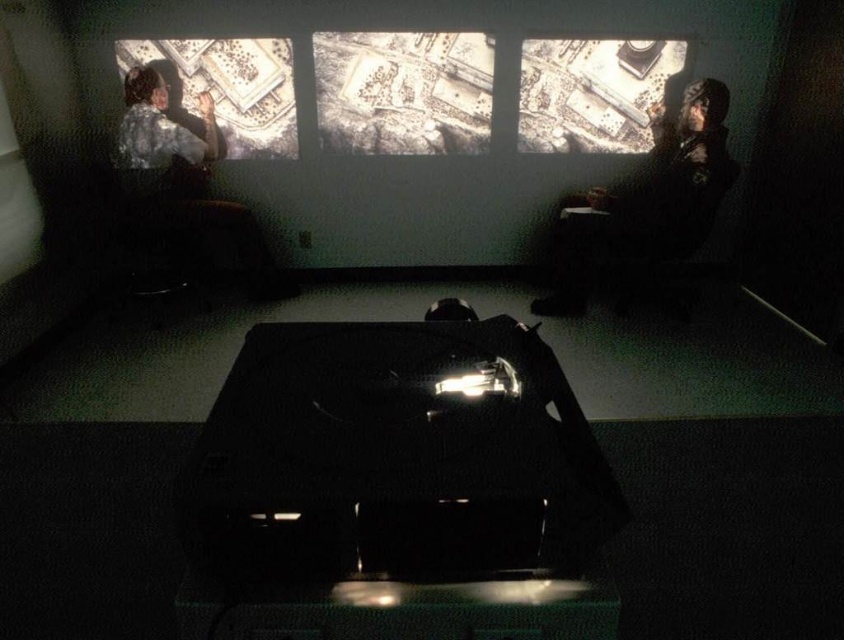
Who is taller, dark fabric jacket at right or matte paper map at upper left?

dark fabric jacket at right is taller.

You are a GUI agent. You are given a task and a screenshot of the screen. Output one action in this format:
    pyautogui.click(x=<x>, y=<y>)
    Task: Click on the dark fabric jacket at right
    The image size is (844, 640).
    Given the screenshot: What is the action you would take?
    pyautogui.click(x=652, y=200)

Which is in front, point (579, 257) or point (246, 44)?

Point (579, 257) is more forward.

You are a GUI agent. You are given a task and a screenshot of the screen. Output one action in this format:
    pyautogui.click(x=<x>, y=<y>)
    Task: Click on the dark fabric jacket at right
    The width and height of the screenshot is (844, 640).
    Given the screenshot: What is the action you would take?
    pyautogui.click(x=652, y=200)

Does black glossy projector at center have a lesser width compared to matte paper map at upper left?

Indeed, black glossy projector at center has a lesser width compared to matte paper map at upper left.

Does black glossy projector at center appear on the left side of matte paper map at upper left?

Incorrect, black glossy projector at center is not on the left side of matte paper map at upper left.

The height and width of the screenshot is (640, 844). What do you see at coordinates (395, 456) in the screenshot?
I see `black glossy projector at center` at bounding box center [395, 456].

Find the location of a particular element. This screenshot has width=844, height=640. black glossy projector at center is located at coordinates (395, 456).

Is black glossy projector at center below dark fabric jacket at right?

Indeed, black glossy projector at center is positioned under dark fabric jacket at right.

Does black glossy projector at center lie in front of dark fabric jacket at right?

Yes, it is.

Is point (287, 388) less distant than point (658, 112)?

Yes, it is.

The width and height of the screenshot is (844, 640). Identify the location of black glossy projector at center. (395, 456).